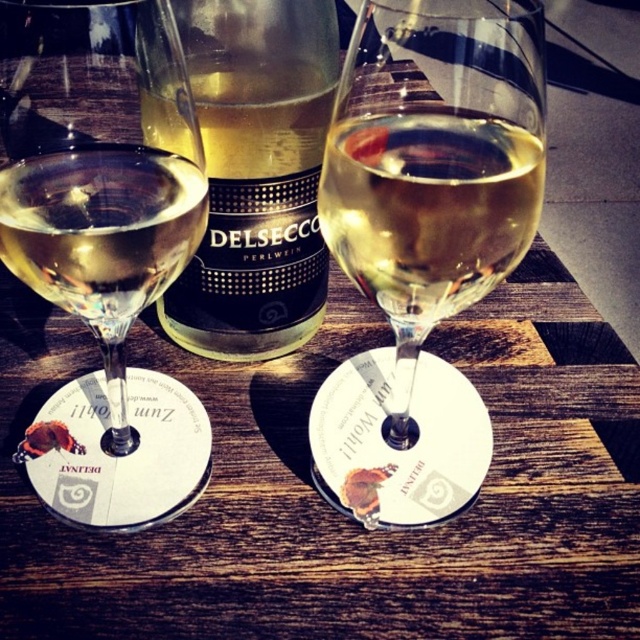
In the scene shown: You are setting up a table for a dinner party and have a small space between two chairs. You need to place both the clear glass wine glass at left and the translucent glass bottle at center. Which item should you place first to ensure they both fit in the space?

The clear glass wine glass at left has a smaller width than the translucent glass bottle at center, so you should place the translucent glass bottle at center first to ensure both items fit in the space.

Looking at this image, you are a bartender preparing drinks for a party. You have a translucent glass bottle at center and a clear glass wine at left. Which container can hold more liquid?

The translucent glass bottle at center is bigger than the clear glass wine at left, so it can hold more liquid.

In the scene shown: What is located at the coordinates point (424, 240)?

The translucent glass wine glass at center is located at point (424, 240).